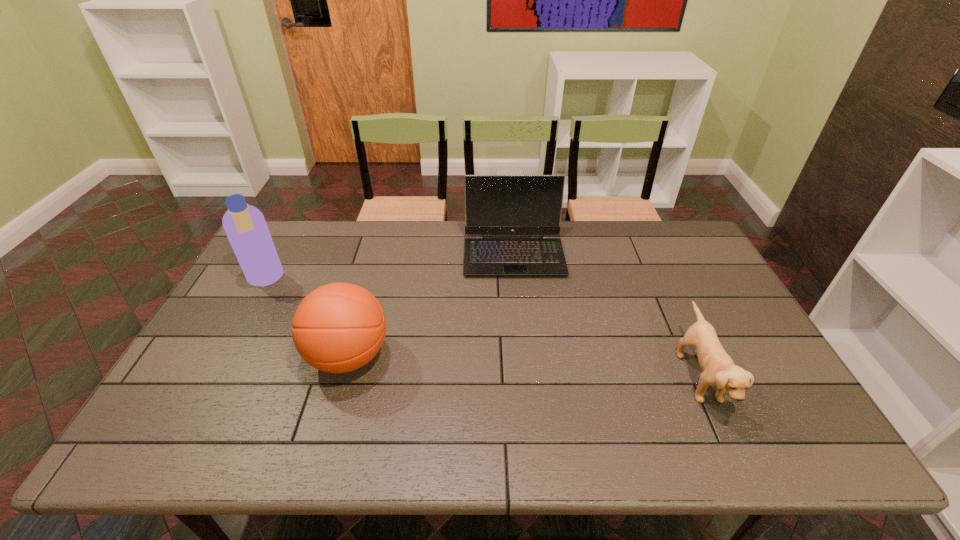
Locate an element on the screen. The height and width of the screenshot is (540, 960). shampoo is located at coordinates (245, 226).

This screenshot has height=540, width=960. What are the coordinates of `the tallest object` in the screenshot? It's located at (245, 226).

The image size is (960, 540). Find the location of `the third object from left to right`. the third object from left to right is located at coordinates click(531, 205).

The width and height of the screenshot is (960, 540). I want to click on the second object from left to right, so click(339, 327).

Locate an element on the screen. Image resolution: width=960 pixels, height=540 pixels. puppy is located at coordinates (719, 369).

Locate an element on the screen. the shortest object is located at coordinates (719, 369).

What are the coordinates of `free location located 0.140m on the right of the leftmost object` in the screenshot? It's located at (327, 280).

This screenshot has height=540, width=960. Identify the location of vacant space located 0.070m on the screen of the second object from right to left. (517, 294).

You are a GUI agent. You are given a task and a screenshot of the screen. Output one action in this format:
    pyautogui.click(x=<x>, y=<y>)
    Task: Click on the free location located 0.260m on the back of the second object from left to right
    The height and width of the screenshot is (540, 960).
    Given the screenshot: What is the action you would take?
    pyautogui.click(x=374, y=267)

Locate an element on the screen. vacant space located 0.220m on the left side of the puppy is located at coordinates (596, 377).